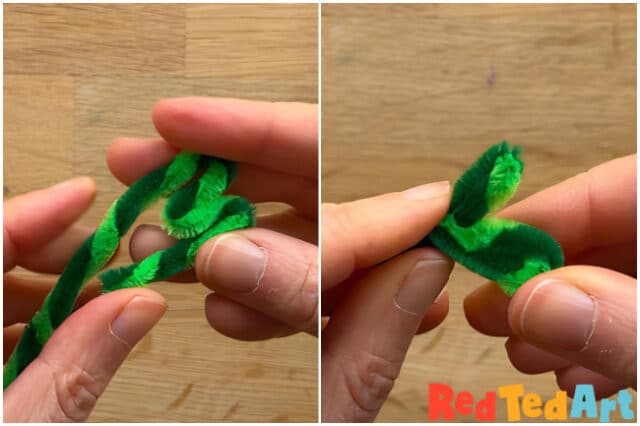
You are a GUI agent. You are given a task and a screenshot of the screen. Output one action in this format:
    pyautogui.click(x=<x>, y=<y>)
    Task: Click on the table
    This screenshot has width=640, height=426.
    Given the screenshot: What is the action you would take?
    pyautogui.click(x=205, y=46), pyautogui.click(x=422, y=61)